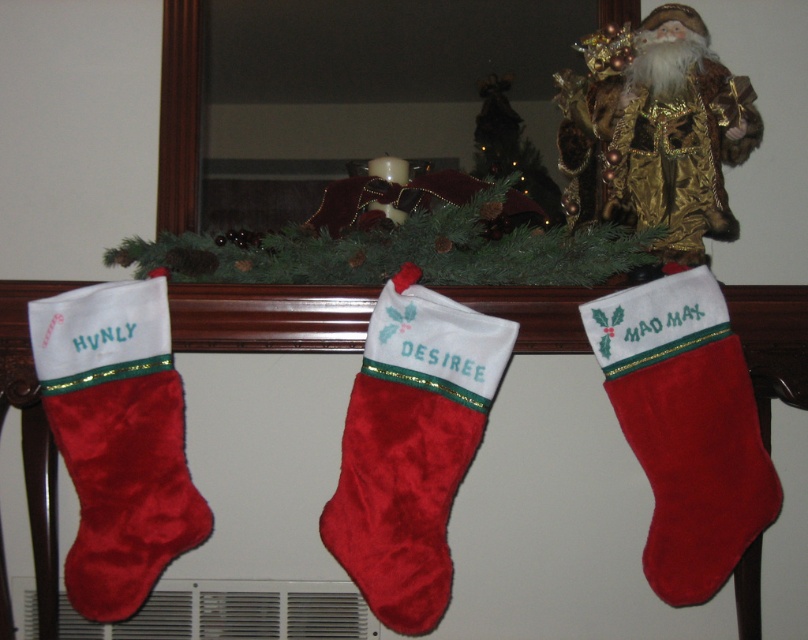
You are a child who just received a new Christmas decoration that is 20 centimeters wide. You want to place it between the velvet red stocking at center and the velvet red stocking at left on the mantel. Will there be enough space for it?

The velvet red stocking at center and the velvet red stocking at left are 22.84 centimeters apart from each other. Since the decoration is 20 centimeters wide, there is enough space to place it between them.

You are a child trying to choose between the velvet red stocking at center and the velvet red stocking at right to put your Christmas wish list. Which one has more space inside?

The velvet red stocking at center is bigger than the velvet red stocking at right, so it has more space inside.